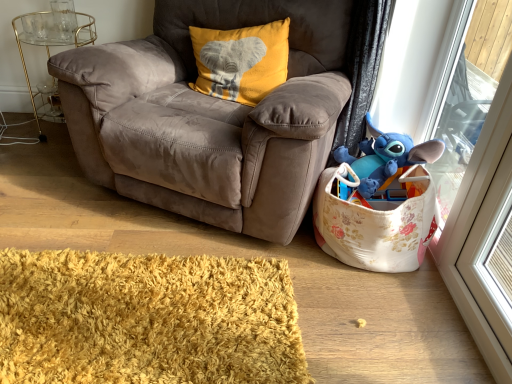
Question: Is floral fabric toy storage at lower right turned away from gold metallic side table at left?

Choices:
 (A) no
 (B) yes

Answer: (A)

Question: Is floral fabric toy storage at lower right closer to camera compared to gold metallic side table at left?

Choices:
 (A) yes
 (B) no

Answer: (A)

Question: Is floral fabric toy storage at lower right further to camera compared to gold metallic side table at left?

Choices:
 (A) yes
 (B) no

Answer: (B)

Question: Is floral fabric toy storage at lower right taller than gold metallic side table at left?

Choices:
 (A) yes
 (B) no

Answer: (B)

Question: Is there a large distance between floral fabric toy storage at lower right and gold metallic side table at left?

Choices:
 (A) no
 (B) yes

Answer: (B)

Question: Is yellow velvet pillow at upper center bigger or smaller than suede brown armchair at center?

Choices:
 (A) big
 (B) small

Answer: (B)

Question: From the image's perspective, relative to suede brown armchair at center, is yellow velvet pillow at upper center above or below?

Choices:
 (A) above
 (B) below

Answer: (A)

Question: Considering the positions of yellow velvet pillow at upper center and suede brown armchair at center in the image, is yellow velvet pillow at upper center wider or thinner than suede brown armchair at center?

Choices:
 (A) thin
 (B) wide

Answer: (A)

Question: Considering the relative positions of yellow velvet pillow at upper center and suede brown armchair at center in the image provided, is yellow velvet pillow at upper center to the left or to the right of suede brown armchair at center?

Choices:
 (A) right
 (B) left

Answer: (A)

Question: Is yellow velvet pillow at upper center wider or thinner than blue plush toy at upper right?

Choices:
 (A) wide
 (B) thin

Answer: (A)

Question: Would you say yellow velvet pillow at upper center is to the left or to the right of blue plush toy at upper right in the picture?

Choices:
 (A) right
 (B) left

Answer: (B)

Question: From a real-world perspective, relative to blue plush toy at upper right, is yellow velvet pillow at upper center vertically above or below?

Choices:
 (A) above
 (B) below

Answer: (A)

Question: In the image, is yellow velvet pillow at upper center positioned in front of or behind blue plush toy at upper right?

Choices:
 (A) front
 (B) behind

Answer: (B)

Question: Considering the positions of suede brown armchair at center and gold metallic side table at left in the image, is suede brown armchair at center taller or shorter than gold metallic side table at left?

Choices:
 (A) tall
 (B) short

Answer: (A)

Question: Considering the positions of suede brown armchair at center and gold metallic side table at left in the image, is suede brown armchair at center wider or thinner than gold metallic side table at left?

Choices:
 (A) thin
 (B) wide

Answer: (B)